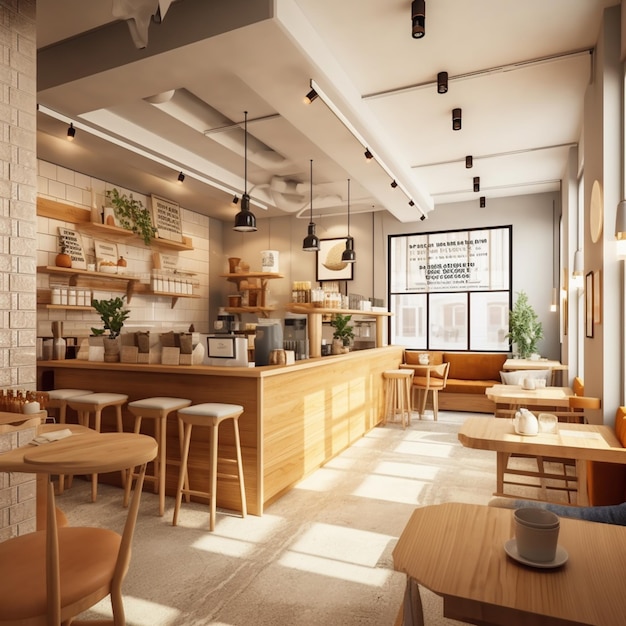
Locate an element on the screen. wooden barstools is located at coordinates (59, 393), (91, 397), (151, 404), (205, 408), (402, 370).